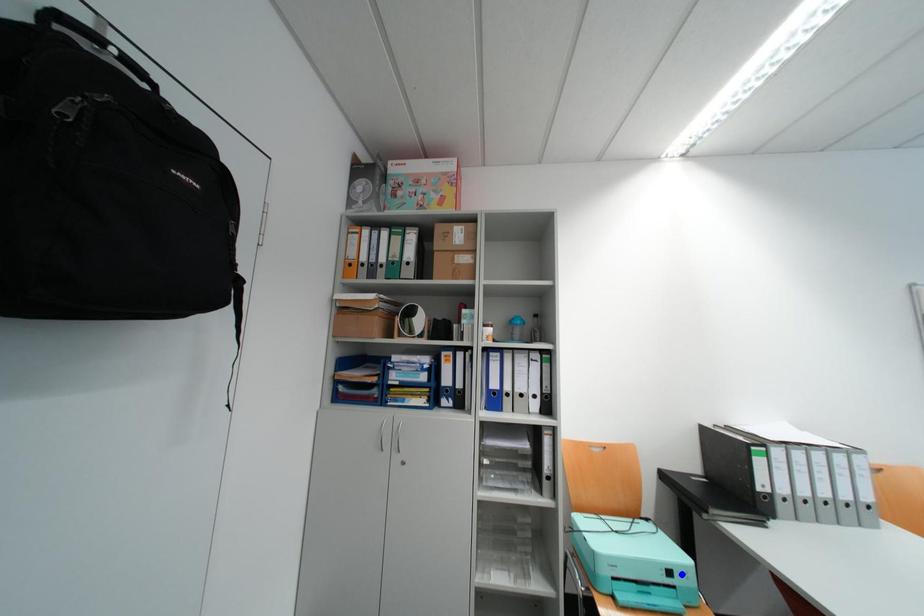
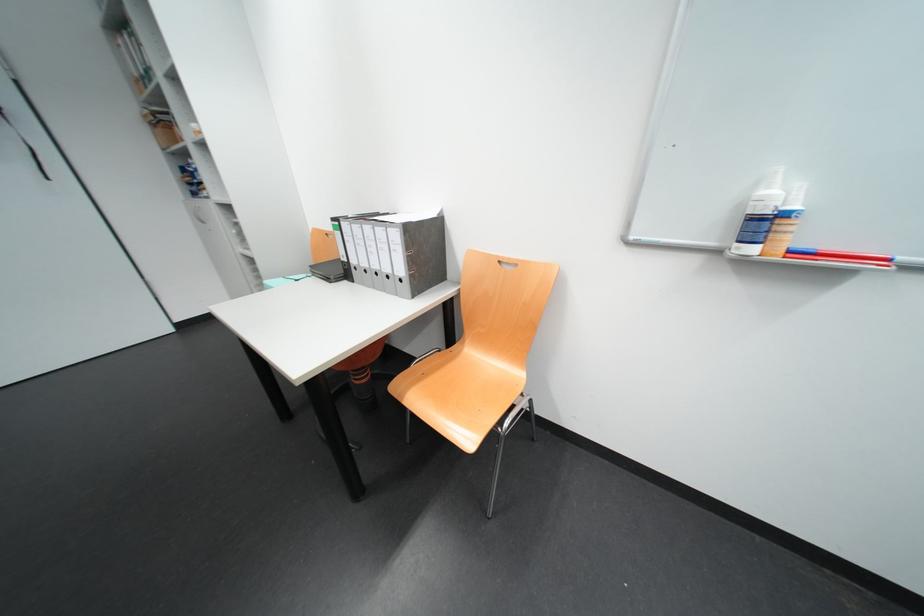
I am providing you with two images of the same scene from different viewpoints. Three points are marked in image1. Which point corresponds to a part or object that is occluded in image2?In image1, three points are marked. Which of them correspond to a part or object that is occluded in image2?Among the three points shown in image1, which one corresponds to a part or object that is no longer visible due to occlusion in image2?

Invisible in image2: green point, yellow point, blue point.